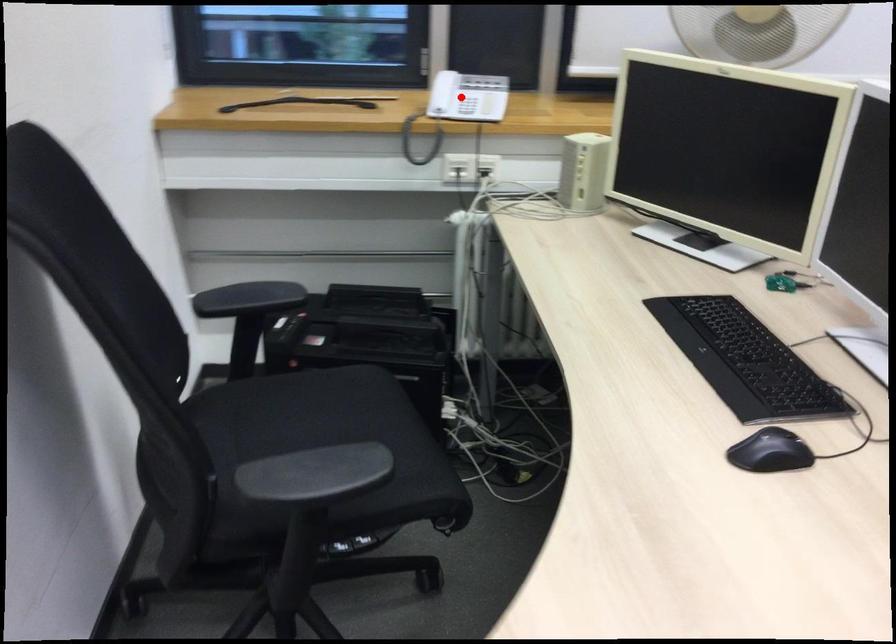
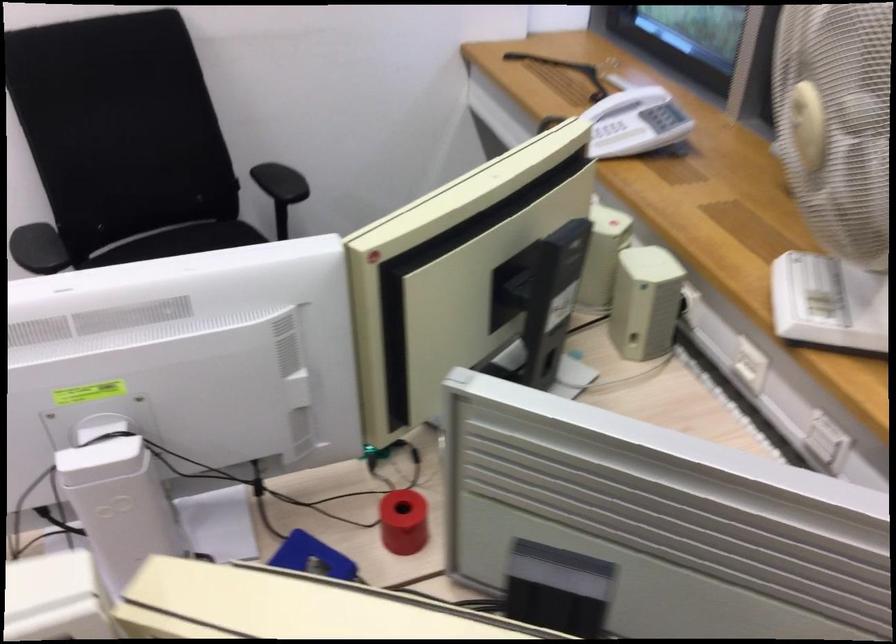
Locate, in the second image, the point that corresponds to the highlighted location in the first image.

(617, 138)